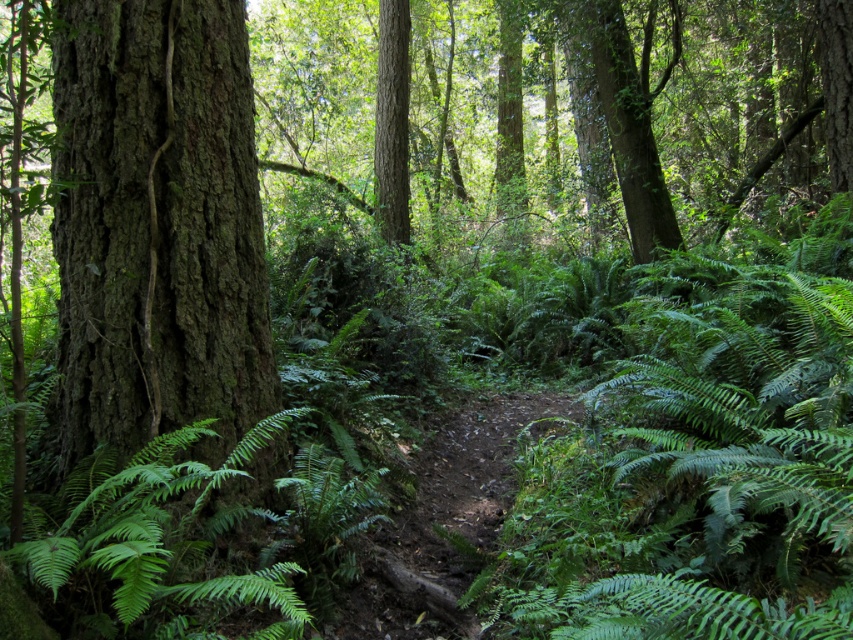
You are a hiker who wants to take a photo of both the green rough bark tree at left and the smooth bark tree at center. Since you have a wide angle lens, which tree should you stand closer to in order to capture both in the frame?

The green rough bark tree at left is shorter than the smooth bark tree at center. To capture both in the frame, you should stand closer to the green rough bark tree at left so that the shorter tree fills the frame while still including the taller tree in the background.

You are a hiker carrying a 2.5 meter long bamboo pole. You want to walk along the dirt path in the forest and need to pass between the green rough bark tree at left and another tree. Can your bamboo pole fit through the space between them without bending?

The space between the green rough bark tree at left and the other tree is 2.67 meters. Since your bamboo pole is 2.5 meters long, it can fit through the space without bending.

You are a hiker walking along the narrow dirt path in the forest. You see a green rough bark tree at left and a smooth bark tree at center. Which tree is closer to your left side as you walk forward?

The green rough bark tree at left is positioned on the left side of the smooth bark tree at center, so as you walk forward along the path, the green rough bark tree at left will be closer to your left side.